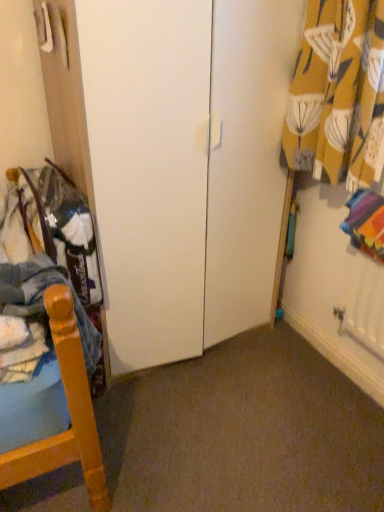
Question: Is yellow floral fabric at upper right bigger or smaller than denim fabric pants at left?

Choices:
 (A) small
 (B) big

Answer: (B)

Question: Is yellow floral fabric at upper right inside the boundaries of denim fabric pants at left, or outside?

Choices:
 (A) outside
 (B) inside

Answer: (A)

Question: From the image's perspective, is yellow floral fabric at upper right above or below denim fabric pants at left?

Choices:
 (A) above
 (B) below

Answer: (A)

Question: Is denim fabric pants at left to the left or to the right of yellow floral fabric at upper right in the image?

Choices:
 (A) left
 (B) right

Answer: (A)

Question: From the image's perspective, is denim fabric pants at left above or below yellow floral fabric at upper right?

Choices:
 (A) above
 (B) below

Answer: (B)

Question: Considering the positions of denim fabric pants at left and yellow floral fabric at upper right in the image, is denim fabric pants at left bigger or smaller than yellow floral fabric at upper right?

Choices:
 (A) big
 (B) small

Answer: (B)

Question: Is denim fabric pants at left spatially inside yellow floral fabric at upper right, or outside of it?

Choices:
 (A) outside
 (B) inside

Answer: (A)